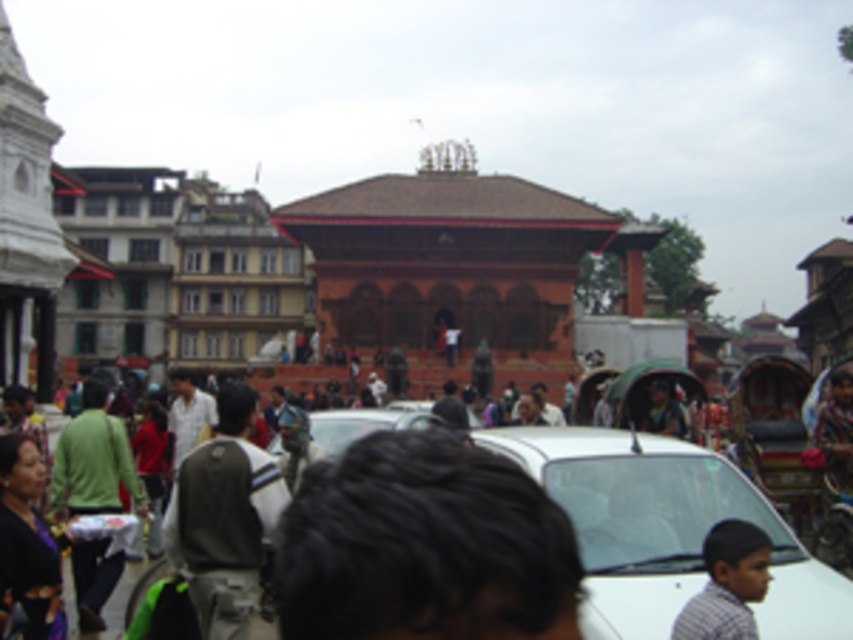
Can you confirm if dark hair at center is thinner than dark purple fabric at lower left?

In fact, dark hair at center might be wider than dark purple fabric at lower left.

Is point (503, 470) positioned after point (38, 541)?

No, it is not.

Image resolution: width=853 pixels, height=640 pixels. What are the coordinates of `dark hair at center` in the screenshot? It's located at (424, 545).

Does point (627, 611) lie behind point (196, 563)?

No, it is in front of (196, 563).

Looking at this image, does white matte car at center appear on the right side of khaki fabric backpack at center?

Indeed, white matte car at center is positioned on the right side of khaki fabric backpack at center.

Which is behind, point (665, 497) or point (265, 465)?

The point (265, 465) is behind.

The height and width of the screenshot is (640, 853). Find the location of `white matte car at center`. white matte car at center is located at coordinates (665, 531).

Which is above, dark purple fabric at lower left or light brown shirt at lower right?

Positioned higher is dark purple fabric at lower left.

Which is in front, point (44, 620) or point (767, 548)?

Point (767, 548) is in front.

Where is `dark purple fabric at lower left`? The height and width of the screenshot is (640, 853). dark purple fabric at lower left is located at coordinates (26, 541).